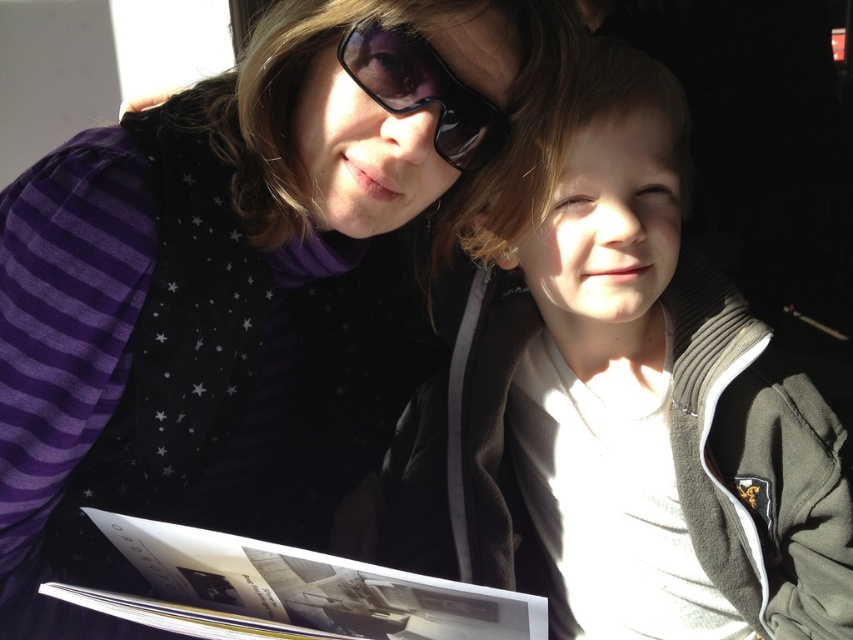
Is light brown hair at center positioned behind matte black sunglasses at upper center?

Yes, light brown hair at center is behind matte black sunglasses at upper center.

Locate an element on the screen. The height and width of the screenshot is (640, 853). light brown hair at center is located at coordinates (625, 416).

At what (x,y) coordinates should I click in order to perform the action: click on light brown hair at center. Please return your answer as a coordinate pair (x, y). Looking at the image, I should click on [625, 416].

Between matte black sweater at upper center and light brown hair at center, which one is positioned higher?

matte black sweater at upper center

Which is below, matte black sweater at upper center or light brown hair at center?

light brown hair at center

The image size is (853, 640). In order to click on matte black sweater at upper center in this screenshot , I will do `click(254, 276)`.

Is matte black sweater at upper center closer to camera compared to matte black sunglasses at upper center?

Yes, it is in front of matte black sunglasses at upper center.

Can you confirm if matte black sweater at upper center is positioned to the left of matte black sunglasses at upper center?

Correct, you'll find matte black sweater at upper center to the left of matte black sunglasses at upper center.

Who is more forward, (125, 236) or (370, 45)?

Point (370, 45) is in front.

You are a GUI agent. You are given a task and a screenshot of the screen. Output one action in this format:
    pyautogui.click(x=<x>, y=<y>)
    Task: Click on the matte black sweater at upper center
    The height and width of the screenshot is (640, 853).
    Given the screenshot: What is the action you would take?
    pyautogui.click(x=254, y=276)